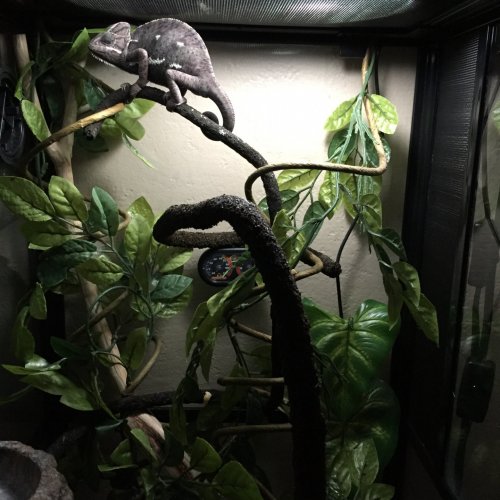
What are the coordinates of `black wall` in the screenshot? It's located at click(447, 197).